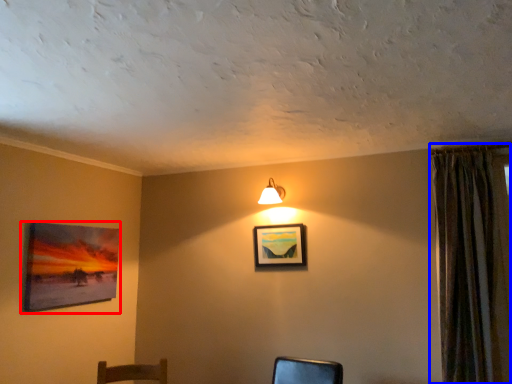
Question: Which object appears closest to the camera in this image, picture frame (highlighted by a red box) or curtain (highlighted by a blue box)?

Choices:
 (A) picture frame
 (B) curtain

Answer: (B)